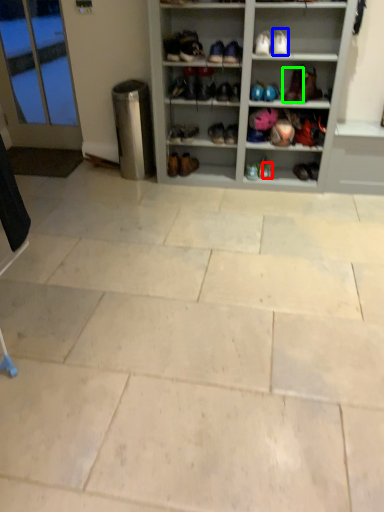
Question: Which object is positioned closest to shoe (highlighted by a red box)? Select from footwear (highlighted by a blue box) and footwear (highlighted by a green box).

Choices:
 (A) footwear
 (B) footwear

Answer: (B)